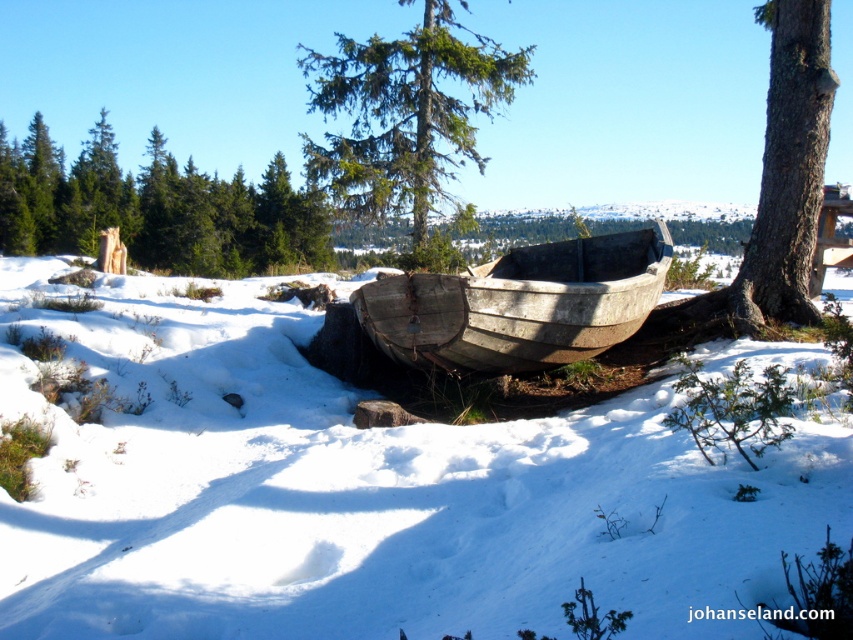
Measure the distance between brown wood tree at left and green textured pine tree at center.

12.13 meters

Does brown wood tree at left have a larger size compared to green textured pine tree at center?

Incorrect, brown wood tree at left is not larger than green textured pine tree at center.

Is point (276, 241) behind point (440, 13)?

Yes.

Image resolution: width=853 pixels, height=640 pixels. Identify the location of brown wood tree at left. (155, 209).

Is brown wood tree at left shorter than brown rough tree trunk at right?

Yes.

Locate an element on the screen. brown wood tree at left is located at coordinates (155, 209).

Locate an element on the screen. Image resolution: width=853 pixels, height=640 pixels. brown wood tree at left is located at coordinates (155, 209).

This screenshot has width=853, height=640. Describe the element at coordinates (361, 493) in the screenshot. I see `white powdery snow at center` at that location.

How distant is white powdery snow at center from brown rough tree trunk at right?

white powdery snow at center and brown rough tree trunk at right are 22.62 feet apart.

Locate an element on the screen. white powdery snow at center is located at coordinates (361, 493).

Find the location of a particular element. The width and height of the screenshot is (853, 640). white powdery snow at center is located at coordinates (361, 493).